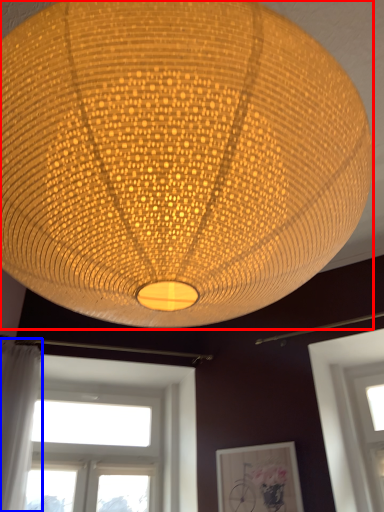
Question: Which of the following is the closest to the observer, lamp (highlighted by a red box) or curtain (highlighted by a blue box)?

Choices:
 (A) lamp
 (B) curtain

Answer: (A)